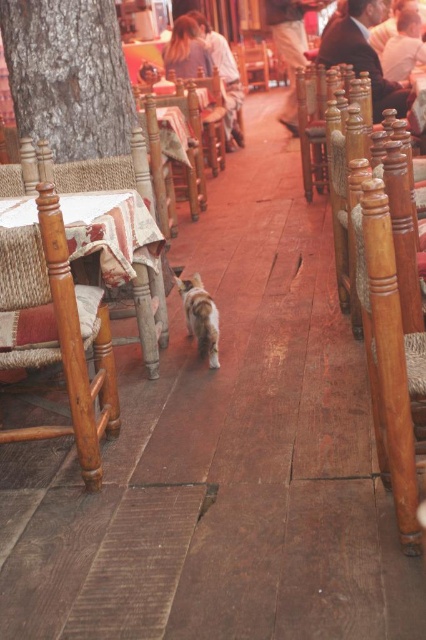
From the picture: Which of these two, wooden chair at center or light brown fabric pants at center, stands shorter?

wooden chair at center

Does wooden chair at center have a greater width compared to light brown fabric pants at center?

No.

You are a GUI agent. You are given a task and a screenshot of the screen. Output one action in this format:
    pyautogui.click(x=<x>, y=<y>)
    Task: Click on the wooden chair at center
    The width and height of the screenshot is (426, 640).
    Given the screenshot: What is the action you would take?
    pyautogui.click(x=184, y=150)

Does wooden chair at left have a greater height compared to smooth skin face at upper right?

Correct, wooden chair at left is much taller as smooth skin face at upper right.

Between wooden chair at left and smooth skin face at upper right, which one is positioned higher?

smooth skin face at upper right is higher up.

Locate an element on the screen. The width and height of the screenshot is (426, 640). wooden chair at left is located at coordinates (57, 332).

Can you confirm if light brown hair at upper right is smaller than smooth skin face at upper right?

No.

Based on the photo, is the position of light brown hair at upper right less distant than that of smooth skin face at upper right?

Yes.

At what (x,y) coordinates should I click in order to perform the action: click on light brown hair at upper right. Please return your answer as a coordinate pair (x, y). The width and height of the screenshot is (426, 640). Looking at the image, I should click on (403, 45).